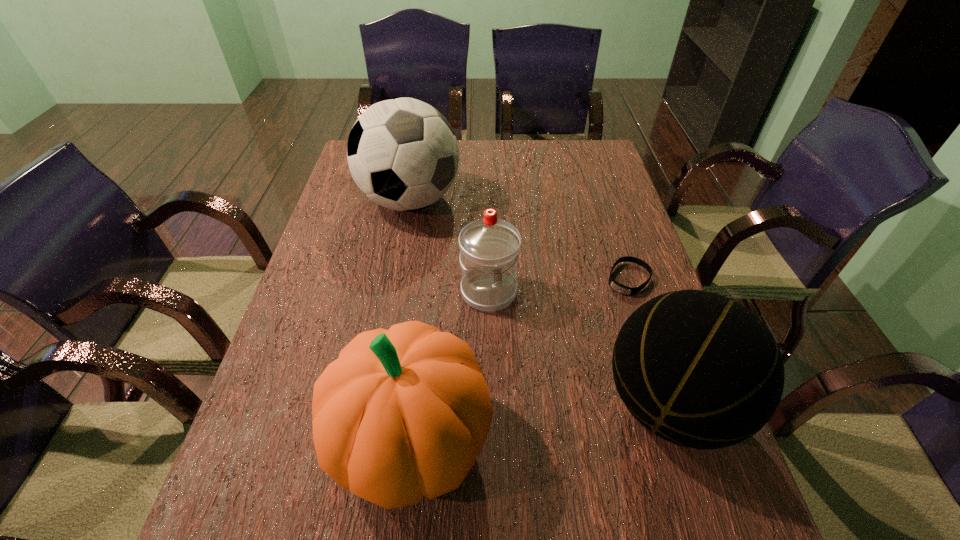
Find the location of a particular element. This screenshot has width=960, height=540. basketball that is at the right edge is located at coordinates (701, 371).

The height and width of the screenshot is (540, 960). I want to click on wristband situated at the right edge, so click(x=629, y=291).

Locate an element on the screen. The width and height of the screenshot is (960, 540). object present at the far left corner is located at coordinates (402, 153).

The image size is (960, 540). Identify the location of object situated at the near right corner. (701, 371).

This screenshot has width=960, height=540. Identify the location of vacant space at the far edge. (553, 168).

In the image, there is a desktop. Identify the location of vacant space at the near edge. The image size is (960, 540). (580, 468).

Find the location of `vacant space at the left edge`. vacant space at the left edge is located at coordinates (327, 250).

Locate an element on the screen. free space at the right edge of the desktop is located at coordinates (612, 339).

What are the coordinates of `vacant area at the near left corner` in the screenshot? It's located at (303, 472).

You are a GUI agent. You are given a task and a screenshot of the screen. Output one action in this format:
    pyautogui.click(x=<x>, y=<y>)
    Task: Click on the vacant space at the far right corner of the desktop
    
    Given the screenshot: What is the action you would take?
    pyautogui.click(x=590, y=169)